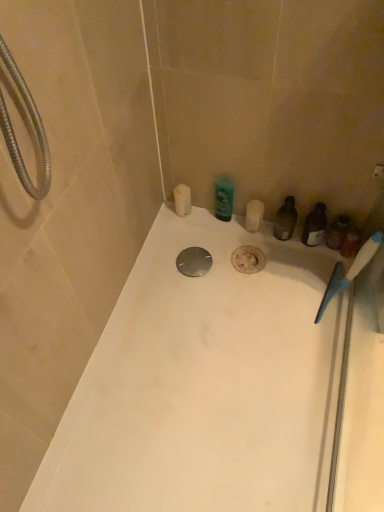
Image resolution: width=384 pixels, height=512 pixels. In order to click on free space in front of green glossy bottle at center, the second toiletry positioned from the right in this screenshot , I will do `click(220, 254)`.